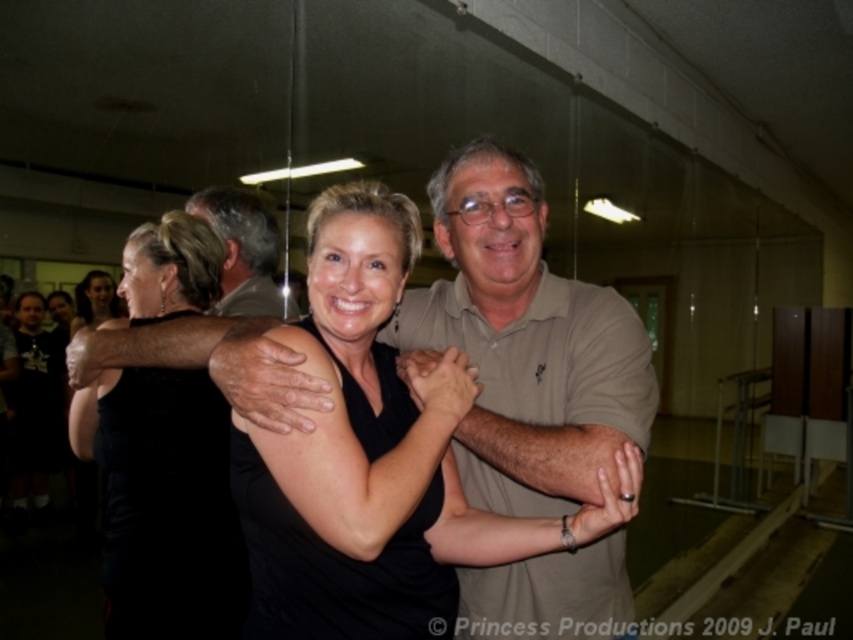
Question: Does matte khaki polo shirt at center have a smaller size compared to gray hair at upper left?

Choices:
 (A) no
 (B) yes

Answer: (A)

Question: Which of these objects is positioned closest to the black dress at center?

Choices:
 (A) matte khaki polo shirt at center
 (B) gray hair at upper left

Answer: (B)

Question: Does gray hair at upper left appear on the left side of black dress at center?

Choices:
 (A) yes
 (B) no

Answer: (B)

Question: Which point is farther to the camera?

Choices:
 (A) (160, 632)
 (B) (85, 289)
 (C) (222, 220)

Answer: (B)

Question: Which point is closer to the camera?

Choices:
 (A) (96, 323)
 (B) (216, 212)
 (C) (526, 483)
 (D) (80, 449)

Answer: (C)

Question: In this image, where is matte khaki polo shirt at center located relative to gray hair at upper left?

Choices:
 (A) below
 (B) above

Answer: (A)